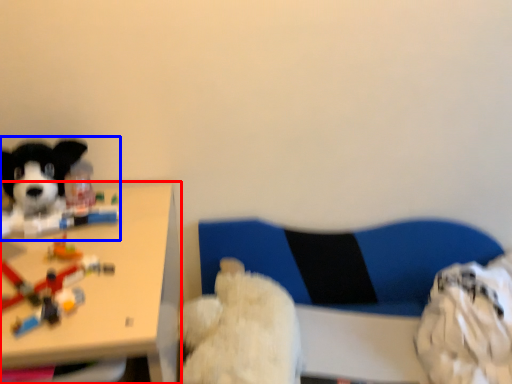
Question: Which point is further to the camera, table (highlighted by a red box) or dog (highlighted by a blue box)?

Choices:
 (A) table
 (B) dog

Answer: (B)